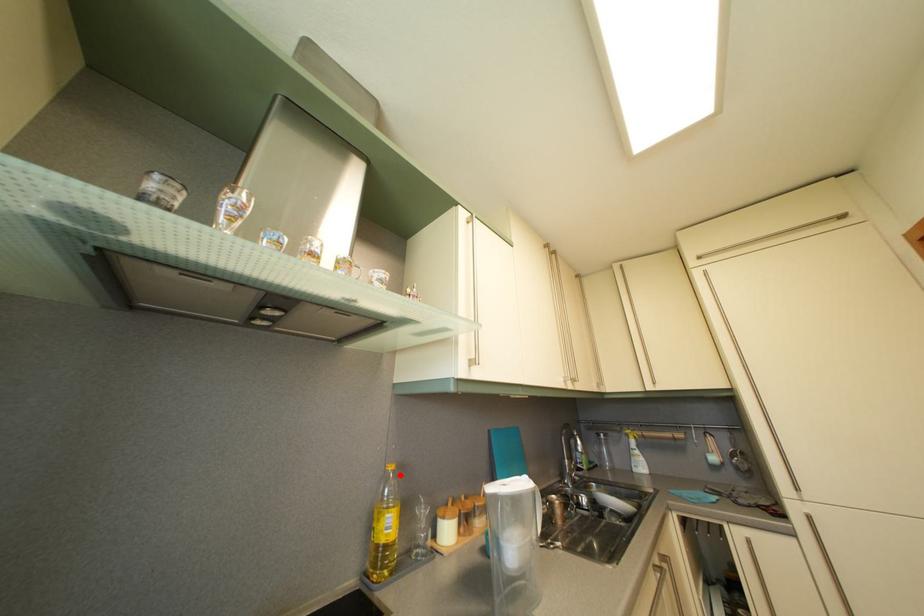
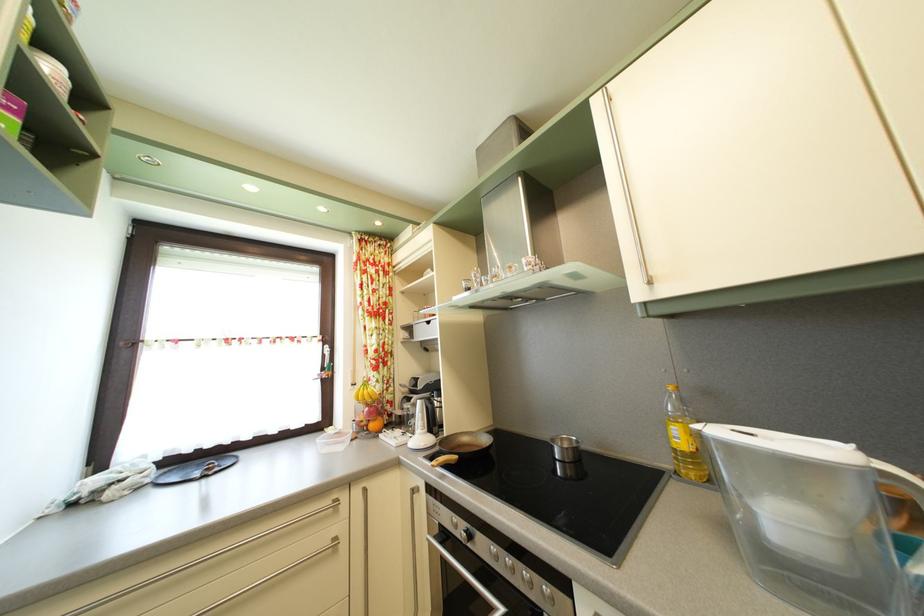
Question: I am providing you with two images of the same scene from different viewpoints. A red point is marked on the first image. Can you still see the location of the red point in image 2?

Choices:
 (A) Yes
 (B) No

Answer: (A)